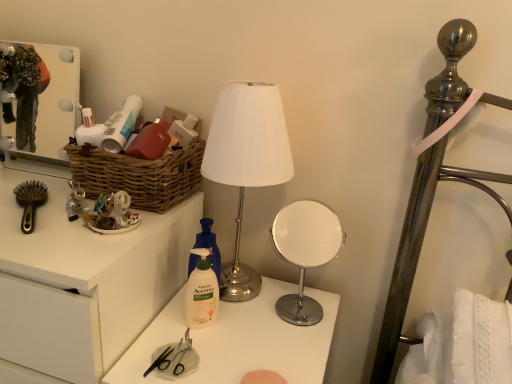
Locate an element on the screen. The image size is (512, 384). empty space that is to the right of white matte lotion at center, marked as the first toiletry in a right-to-left arrangement is located at coordinates (264, 332).